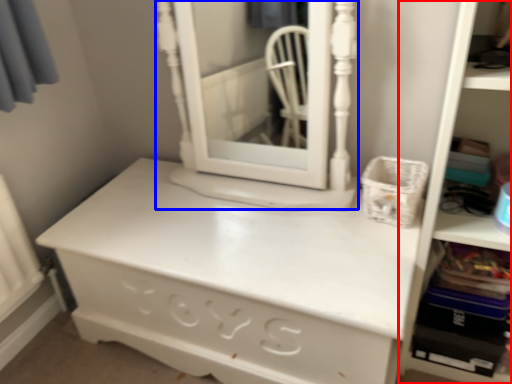
Question: Among these objects, which one is farthest to the camera, bookshelf (highlighted by a red box) or medicine cabinet (highlighted by a blue box)?

Choices:
 (A) bookshelf
 (B) medicine cabinet

Answer: (B)